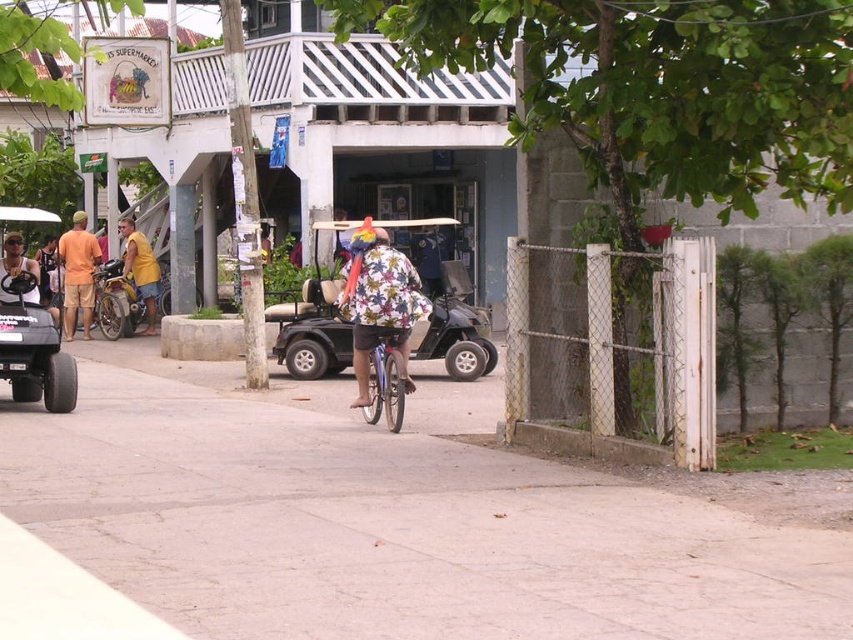
Which is behind, point (463, 337) or point (392, 404)?

Positioned behind is point (463, 337).

Locate an element on the screen. Image resolution: width=853 pixels, height=640 pixels. metallic gray golf cart at center is located at coordinates (314, 321).

Who is positioned more to the left, metallic blue bicycle at center or yellow cotton shirt at left?

From the viewer's perspective, yellow cotton shirt at left appears more on the left side.

Does metallic blue bicycle at center appear on the left side of yellow cotton shirt at left?

No, metallic blue bicycle at center is not to the left of yellow cotton shirt at left.

Is point (369, 353) closer to viewer compared to point (119, 220)?

Yes, point (369, 353) is in front of point (119, 220).

Identify the location of metallic blue bicycle at center. This screenshot has width=853, height=640. (386, 378).

Is point (689, 502) closer to viewer compared to point (24, 317)?

Yes, point (689, 502) is in front of point (24, 317).

Who is more forward, [164,518] or [39,384]?

Point [164,518] is in front.

Who is more forward, (235, 522) or (9, 218)?

Point (235, 522) is more forward.

At what (x,y) coordinates should I click in order to perform the action: click on gray concrete pavement at center. Please return your answer as a coordinate pair (x, y). Looking at the image, I should click on click(402, 516).